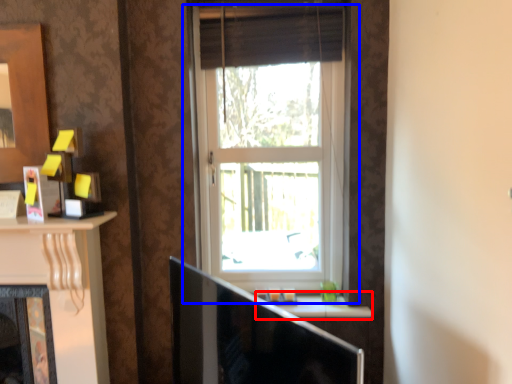
Question: Which point is closer to the camera, window sill (highlighted by a red box) or window (highlighted by a blue box)?

Choices:
 (A) window sill
 (B) window

Answer: (B)